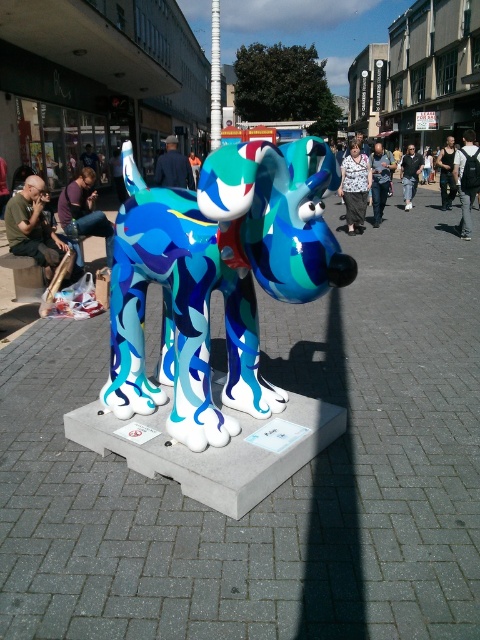
In the scene shown: You are a street artist planning to place a new sculpture between the white plastic pole at center and the black cotton shirt at center. Considering their heights, which object should the sculpture be placed closer to in order to maintain visual balance?

The white plastic pole at center is taller than the black cotton shirt at center. To maintain visual balance, the sculpture should be placed closer to the black cotton shirt at center since it is shorter, balancing the height difference.

You are standing on the paved urban street where the art installation is located. You want to locate the smooth concrete base at center. According to the coordinates provided, where would you find it?

The smooth concrete base at center is located at point (277, 488).